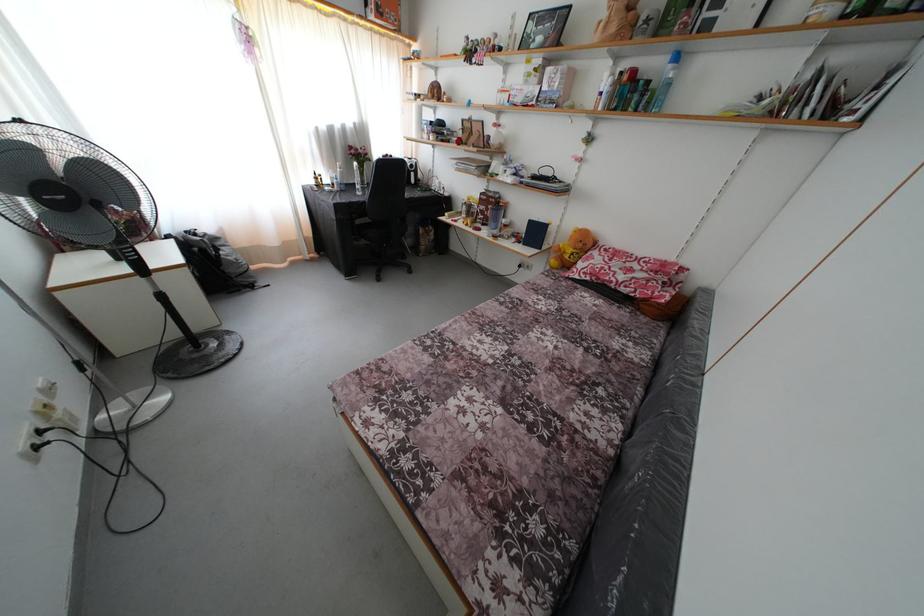
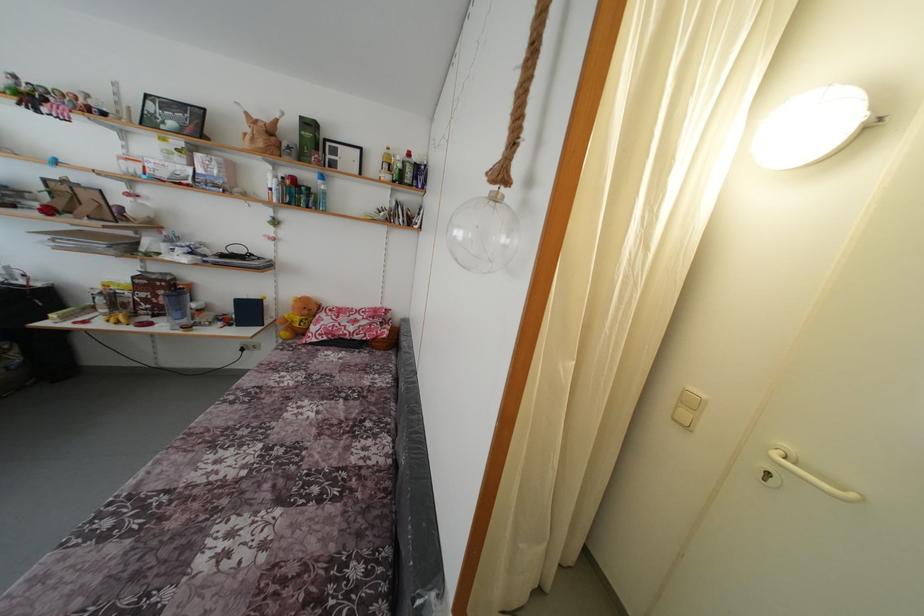
Find the pixel in the second image that matches point (604, 261) in the first image.

(332, 321)